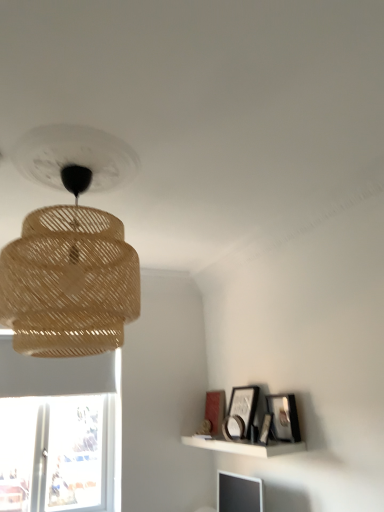
What are the coordinates of `matte black monitor at lower right` in the screenshot? It's located at coord(239,493).

Describe the element at coordinates (283, 417) in the screenshot. I see `matte black picture frame at upper right, the fourth picture frame from the back` at that location.

Where is `matte black picture frame at upper right, the fourth picture frame from the back`? The width and height of the screenshot is (384, 512). matte black picture frame at upper right, the fourth picture frame from the back is located at coordinates (283, 417).

This screenshot has height=512, width=384. What are the coordinates of `matte black picture frame at upper right, the 2th picture frame from the back` in the screenshot? It's located at (244, 405).

The width and height of the screenshot is (384, 512). Find the location of `white matte shelf at lower right`. white matte shelf at lower right is located at coordinates (243, 446).

What do you see at coordinates (265, 429) in the screenshot?
I see `matte black picture frame at lower right, arranged as the 1th picture frame when viewed from the front` at bounding box center [265, 429].

The height and width of the screenshot is (512, 384). Describe the element at coordinates (238, 426) in the screenshot. I see `wooden picture frame at upper right, marked as the third picture frame in a back-to-front arrangement` at that location.

Identify the location of matte black monitor at lower right. (239, 493).

Locate an element on the screen. This screenshot has width=384, height=512. shelf in front of the wooden picture frame at upper right, marked as the third picture frame in a back-to-front arrangement is located at coordinates (243, 446).

Between wooden picture frame at upper right, placed as the 3th picture frame when sorted from front to back, and white matte shelf at lower right, which one has smaller width?

With smaller width is wooden picture frame at upper right, placed as the 3th picture frame when sorted from front to back.

Is wooden picture frame at upper right, marked as the third picture frame in a back-to-front arrangement, positioned before white matte shelf at lower right?

No.

Which is correct: wooden picture frame at upper right, marked as the third picture frame in a back-to-front arrangement, is inside white matte shelf at lower right, or outside of it?

wooden picture frame at upper right, marked as the third picture frame in a back-to-front arrangement, is located beyond the bounds of white matte shelf at lower right.

Locate an element on the screen. This screenshot has width=384, height=512. the 4th picture frame below the natural woven lampshade at upper left (from the image's perspective) is located at coordinates (238, 426).

Is point (63, 322) positioned behind point (228, 440)?

No, it is in front of (228, 440).

From a real-world perspective, is natural woven lampshade at upper left beneath wooden picture frame at upper right, marked as the third picture frame in a back-to-front arrangement?

No, from a real-world perspective, natural woven lampshade at upper left is not below wooden picture frame at upper right, marked as the third picture frame in a back-to-front arrangement.

Considering the relative positions of natural woven lampshade at upper left and wooden picture frame at upper right, marked as the third picture frame in a back-to-front arrangement, in the image provided, is natural woven lampshade at upper left to the left of wooden picture frame at upper right, marked as the third picture frame in a back-to-front arrangement, from the viewer's perspective?

Correct, you'll find natural woven lampshade at upper left to the left of wooden picture frame at upper right, marked as the third picture frame in a back-to-front arrangement.

From the image's perspective, is matte black picture frame at upper right, the fourth picture frame from the back, on top of natural woven lampshade at upper left?

No, from the image's perspective, matte black picture frame at upper right, the fourth picture frame from the back, is not on top of natural woven lampshade at upper left.

Consider the image. Is matte black picture frame at upper right, which is the second picture frame in front-to-back order, wider or thinner than natural woven lampshade at upper left?

Considering their sizes, matte black picture frame at upper right, which is the second picture frame in front-to-back order, looks slimmer than natural woven lampshade at upper left.

Based on the photo, from a real-world perspective, between matte black picture frame at upper right, the fourth picture frame from the back, and natural woven lampshade at upper left, who is vertically lower?

matte black picture frame at upper right, the fourth picture frame from the back.

Is wooden picture frame at upper right, marked as the third picture frame in a back-to-front arrangement, to the left of natural woven lampshade at upper left from the viewer's perspective?

No.

Based on the photo, is wooden picture frame at upper right, marked as the third picture frame in a back-to-front arrangement, smaller than natural woven lampshade at upper left?

Indeed, wooden picture frame at upper right, marked as the third picture frame in a back-to-front arrangement, has a smaller size compared to natural woven lampshade at upper left.

Which is in front, wooden picture frame at upper right, marked as the third picture frame in a back-to-front arrangement, or natural woven lampshade at upper left?

Positioned in front is natural woven lampshade at upper left.

Between point (237, 423) and point (60, 248), which one is positioned behind?

The point (237, 423) is farther from the camera.

In the scene shown: From the image's perspective, does white matte shelf at lower right appear higher than wooden picture frame at upper right, placed as the 3th picture frame when sorted from front to back?

Actually, white matte shelf at lower right appears below wooden picture frame at upper right, placed as the 3th picture frame when sorted from front to back, in the image.

Which point is more forward, (237,446) or (226,418)?

Point (237,446)

Can you confirm if white matte shelf at lower right is taller than wooden picture frame at upper right, marked as the third picture frame in a back-to-front arrangement?

No, white matte shelf at lower right is not taller than wooden picture frame at upper right, marked as the third picture frame in a back-to-front arrangement.

Can you confirm if matte black picture frame at upper right, positioned as the 4th picture frame in front-to-back order, is bigger than white matte shelf at lower right?

No, matte black picture frame at upper right, positioned as the 4th picture frame in front-to-back order, is not bigger than white matte shelf at lower right.

Is white matte shelf at lower right at the back of matte black picture frame at upper right, positioned as the 4th picture frame in front-to-back order?

No, matte black picture frame at upper right, positioned as the 4th picture frame in front-to-back order,'s orientation is not away from white matte shelf at lower right.

Considering the relative sizes of matte black picture frame at upper right, positioned as the 4th picture frame in front-to-back order, and white matte shelf at lower right in the image provided, is matte black picture frame at upper right, positioned as the 4th picture frame in front-to-back order, taller than white matte shelf at lower right?

Yes.

At what (x,y) coordinates should I click in order to perform the action: click on the 4th picture frame behind the white matte shelf at lower right. Please return your answer as a coordinate pair (x, y). Looking at the image, I should click on (244, 405).

Between matte black picture frame at upper right, marked as the 1th picture frame in a back-to-front arrangement, and matte black picture frame at upper right, which is the second picture frame in front-to-back order, which one has less height?

matte black picture frame at upper right, which is the second picture frame in front-to-back order, is shorter.

Considering the relative positions of matte black picture frame at upper right, marked as the 1th picture frame in a back-to-front arrangement, and matte black picture frame at upper right, the fourth picture frame from the back, in the image provided, is matte black picture frame at upper right, marked as the 1th picture frame in a back-to-front arrangement, in front of matte black picture frame at upper right, the fourth picture frame from the back,?

No, it is not.

Between matte black picture frame at upper right, marked as the 1th picture frame in a back-to-front arrangement, and matte black picture frame at upper right, which is the second picture frame in front-to-back order, which one has larger width?

With larger width is matte black picture frame at upper right, which is the second picture frame in front-to-back order.

From a real-world perspective, which is physically below, matte black picture frame at upper right, marked as the 1th picture frame in a back-to-front arrangement, or matte black picture frame at upper right, the fourth picture frame from the back?

In real-world perspective, matte black picture frame at upper right, the fourth picture frame from the back, is lower.

Where is `shelf in front of the wooden picture frame at upper right, marked as the third picture frame in a back-to-front arrangement`? The height and width of the screenshot is (512, 384). shelf in front of the wooden picture frame at upper right, marked as the third picture frame in a back-to-front arrangement is located at coordinates (243, 446).

Where is `the 4th picture frame positioned below the natural woven lampshade at upper left (from the image's perspective)`? The image size is (384, 512). the 4th picture frame positioned below the natural woven lampshade at upper left (from the image's perspective) is located at coordinates point(238,426).

Estimate the real-world distances between objects in this image. Which object is further from matte black picture frame at lower right, arranged as the 1th picture frame when viewed from the front, white matte shelf at lower right or matte black monitor at lower right?

Based on the image, matte black monitor at lower right appears to be further to matte black picture frame at lower right, arranged as the 1th picture frame when viewed from the front.

When comparing their distances from white matte shelf at lower right, does matte black picture frame at upper right, the 2th picture frame from the back, or matte black picture frame at upper right, marked as the 1th picture frame in a back-to-front arrangement, seem closer?

matte black picture frame at upper right, the 2th picture frame from the back, is closer to white matte shelf at lower right.

Estimate the real-world distances between objects in this image. Which object is further from matte black picture frame at upper right, positioned as the 4th picture frame in front-to-back order, matte black monitor at lower right or matte black picture frame at lower right, arranged as the fifth picture frame when viewed from the back?

The object further to matte black picture frame at upper right, positioned as the 4th picture frame in front-to-back order, is matte black monitor at lower right.

Which object lies further to the anchor point matte black picture frame at upper right, the fourth picture frame from the back, matte black monitor at lower right or matte black picture frame at lower right, arranged as the 1th picture frame when viewed from the front?

The object further to matte black picture frame at upper right, the fourth picture frame from the back, is matte black monitor at lower right.

Based on their spatial positions, is matte black picture frame at upper right, which is the second picture frame in front-to-back order, or matte black picture frame at lower right, arranged as the 1th picture frame when viewed from the front, further from white matte shelf at lower right?

Among the two, matte black picture frame at lower right, arranged as the 1th picture frame when viewed from the front, is located further to white matte shelf at lower right.

In the scene shown: From the image, which object appears to be nearer to matte black monitor at lower right, natural woven lampshade at upper left or matte black picture frame at upper right, the fourth picture frame from the back?

matte black picture frame at upper right, the fourth picture frame from the back, is closer to matte black monitor at lower right.

From the image, which object appears to be farther from matte black picture frame at lower right, arranged as the 1th picture frame when viewed from the front, matte black picture frame at upper right, positioned as the 4th picture frame in front-to-back order, or white matte shelf at lower right?

The object further to matte black picture frame at lower right, arranged as the 1th picture frame when viewed from the front, is matte black picture frame at upper right, positioned as the 4th picture frame in front-to-back order.

From the image, which object appears to be farther from matte black picture frame at upper right, positioned as the 4th picture frame in front-to-back order, natural woven lampshade at upper left or matte black picture frame at upper right, marked as the 1th picture frame in a back-to-front arrangement?

The object further to matte black picture frame at upper right, positioned as the 4th picture frame in front-to-back order, is natural woven lampshade at upper left.

Locate an element on the screen. This screenshot has width=384, height=512. shelf between natural woven lampshade at upper left and matte black picture frame at upper right, positioned as the 4th picture frame in front-to-back order, in the front-back direction is located at coordinates (243, 446).

Locate an element on the screen. computer monitor located between natural woven lampshade at upper left and matte black picture frame at upper right, marked as the 1th picture frame in a back-to-front arrangement, in the depth direction is located at coordinates (239, 493).

The width and height of the screenshot is (384, 512). Find the location of `shelf between matte black picture frame at lower right, arranged as the 1th picture frame when viewed from the front, and matte black monitor at lower right in the up-down direction`. shelf between matte black picture frame at lower right, arranged as the 1th picture frame when viewed from the front, and matte black monitor at lower right in the up-down direction is located at coordinates (243, 446).

Locate an element on the screen. The height and width of the screenshot is (512, 384). picture frame between wooden picture frame at upper right, placed as the 3th picture frame when sorted from front to back, and matte black picture frame at upper right, acting as the fifth picture frame starting from the front, in the front-back direction is located at coordinates (244, 405).